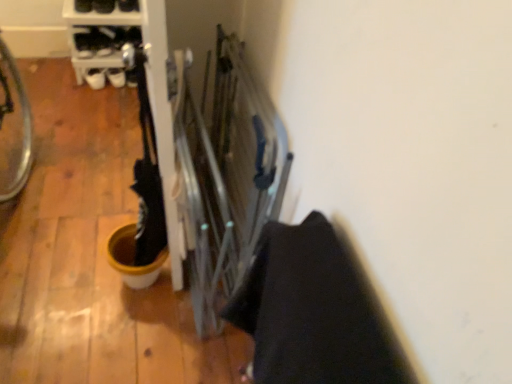
Where is `black leather shoe at upper center, the first footwear when ordered from right to left`? black leather shoe at upper center, the first footwear when ordered from right to left is located at coordinates click(x=128, y=5).

What do you see at coordinates (128, 5) in the screenshot? I see `black leather shoe at upper center, the second footwear when ordered from left to right` at bounding box center [128, 5].

This screenshot has height=384, width=512. What do you see at coordinates (103, 6) in the screenshot?
I see `black leather shoe at upper left, which is the 2th footwear from right to left` at bounding box center [103, 6].

At what (x,y) coordinates should I click in order to perform the action: click on black leather shoe at upper left, which is counted as the 1th footwear, starting from the left. Please return your answer as a coordinate pair (x, y). Looking at the image, I should click on (103, 6).

Identify the location of black leather shoe at upper center, the second footwear when ordered from left to right. (128, 5).

Between black leather shoe at upper left, which is the 2th footwear from right to left, and black leather shoe at upper center, the second footwear when ordered from left to right, which one appears on the right side from the viewer's perspective?

black leather shoe at upper center, the second footwear when ordered from left to right, is more to the right.

Which object is further away from the camera, black leather shoe at upper left, which is counted as the 1th footwear, starting from the left, or black leather shoe at upper center, the first footwear when ordered from right to left?

black leather shoe at upper center, the first footwear when ordered from right to left, is more distant.

Between point (105, 8) and point (137, 7), which one is positioned behind?

The point (105, 8) is farther from the camera.

From the image's perspective, is black leather shoe at upper left, which is counted as the 1th footwear, starting from the left, on black leather shoe at upper center, the second footwear when ordered from left to right?

No, from the image's perspective, black leather shoe at upper left, which is counted as the 1th footwear, starting from the left, is not on top of black leather shoe at upper center, the second footwear when ordered from left to right.

From a real-world perspective, relative to black leather shoe at upper center, the first footwear when ordered from right to left, is black leather shoe at upper left, which is counted as the 1th footwear, starting from the left, vertically above or below?

black leather shoe at upper left, which is counted as the 1th footwear, starting from the left, is above black leather shoe at upper center, the first footwear when ordered from right to left.

Which of these two, black leather shoe at upper left, which is the 2th footwear from right to left, or black leather shoe at upper center, the second footwear when ordered from left to right, is thinner?

black leather shoe at upper center, the second footwear when ordered from left to right, is thinner.

Does black leather shoe at upper left, which is the 2th footwear from right to left, have a greater height compared to black leather shoe at upper center, the first footwear when ordered from right to left?

Indeed, black leather shoe at upper left, which is the 2th footwear from right to left, has a greater height compared to black leather shoe at upper center, the first footwear when ordered from right to left.

Based on their sizes in the image, would you say black leather shoe at upper left, which is counted as the 1th footwear, starting from the left, is bigger or smaller than black leather shoe at upper center, the second footwear when ordered from left to right?

Clearly, black leather shoe at upper left, which is counted as the 1th footwear, starting from the left, is larger in size than black leather shoe at upper center, the second footwear when ordered from left to right.

Is black leather shoe at upper center, the second footwear when ordered from left to right, a part of black leather shoe at upper left, which is the 2th footwear from right to left?

Actually, black leather shoe at upper center, the second footwear when ordered from left to right, is outside black leather shoe at upper left, which is the 2th footwear from right to left.

Is black leather shoe at upper left, which is counted as the 1th footwear, starting from the left, far from black leather shoe at upper center, the first footwear when ordered from right to left?

No, black leather shoe at upper left, which is counted as the 1th footwear, starting from the left, is not far away from black leather shoe at upper center, the first footwear when ordered from right to left.

Does black leather shoe at upper left, which is counted as the 1th footwear, starting from the left, turn towards black leather shoe at upper center, the first footwear when ordered from right to left?

No, black leather shoe at upper left, which is counted as the 1th footwear, starting from the left, does not turn towards black leather shoe at upper center, the first footwear when ordered from right to left.

In the scene shown: How far apart are black leather shoe at upper left, which is the 2th footwear from right to left, and black leather shoe at upper center, the first footwear when ordered from right to left?

black leather shoe at upper left, which is the 2th footwear from right to left, and black leather shoe at upper center, the first footwear when ordered from right to left, are 3.15 inches apart from each other.

I want to click on footwear above the black leather shoe at upper left, which is counted as the 1th footwear, starting from the left (from the image's perspective), so point(128,5).

Considering the relative positions of black leather shoe at upper center, the second footwear when ordered from left to right, and black leather shoe at upper left, which is counted as the 1th footwear, starting from the left, in the image provided, is black leather shoe at upper center, the second footwear when ordered from left to right, to the left of black leather shoe at upper left, which is counted as the 1th footwear, starting from the left, from the viewer's perspective?

In fact, black leather shoe at upper center, the second footwear when ordered from left to right, is to the right of black leather shoe at upper left, which is counted as the 1th footwear, starting from the left.

Consider the image. Between black leather shoe at upper center, the second footwear when ordered from left to right, and black leather shoe at upper left, which is counted as the 1th footwear, starting from the left, which one is positioned in front?

black leather shoe at upper left, which is counted as the 1th footwear, starting from the left.

Does point (126, 1) appear closer or farther from the camera than point (98, 6)?

Point (126, 1) appears to be closer to the viewer than point (98, 6).

From the image's perspective, which object appears higher, black leather shoe at upper center, the second footwear when ordered from left to right, or black leather shoe at upper left, which is counted as the 1th footwear, starting from the left?

black leather shoe at upper center, the second footwear when ordered from left to right.

From a real-world perspective, relative to black leather shoe at upper left, which is counted as the 1th footwear, starting from the left, is black leather shoe at upper center, the first footwear when ordered from right to left, vertically above or below?

black leather shoe at upper center, the first footwear when ordered from right to left, is situated lower than black leather shoe at upper left, which is counted as the 1th footwear, starting from the left, in the real world.

Which of these two, black leather shoe at upper center, the first footwear when ordered from right to left, or black leather shoe at upper left, which is counted as the 1th footwear, starting from the left, is wider?

With larger width is black leather shoe at upper left, which is counted as the 1th footwear, starting from the left.

Who is taller, black leather shoe at upper center, the first footwear when ordered from right to left, or black leather shoe at upper left, which is counted as the 1th footwear, starting from the left?

black leather shoe at upper left, which is counted as the 1th footwear, starting from the left, is taller.

Can you confirm if black leather shoe at upper center, the first footwear when ordered from right to left, is bigger than black leather shoe at upper left, which is counted as the 1th footwear, starting from the left?

Actually, black leather shoe at upper center, the first footwear when ordered from right to left, might be smaller than black leather shoe at upper left, which is counted as the 1th footwear, starting from the left.

Is black leather shoe at upper center, the first footwear when ordered from right to left, inside the boundaries of black leather shoe at upper left, which is the 2th footwear from right to left, or outside?

black leather shoe at upper center, the first footwear when ordered from right to left, is not enclosed by black leather shoe at upper left, which is the 2th footwear from right to left.

Is black leather shoe at upper center, the second footwear when ordered from left to right, positioned far away from black leather shoe at upper left, which is the 2th footwear from right to left?

They are positioned close to each other.

Looking at this image, does black leather shoe at upper center, the first footwear when ordered from right to left, turn towards black leather shoe at upper left, which is counted as the 1th footwear, starting from the left?

No.

How different are the orientations of black leather shoe at upper center, the first footwear when ordered from right to left, and black leather shoe at upper left, which is the 2th footwear from right to left, in degrees?

There is a 1.59-degree angle between the facing directions of black leather shoe at upper center, the first footwear when ordered from right to left, and black leather shoe at upper left, which is the 2th footwear from right to left.

Identify the location of footwear that is on the left side of black leather shoe at upper center, the first footwear when ordered from right to left. The height and width of the screenshot is (384, 512). (103, 6).

The height and width of the screenshot is (384, 512). What are the coordinates of `footwear that appears behind the black leather shoe at upper left, which is the 2th footwear from right to left` in the screenshot? It's located at (128, 5).

You are a GUI agent. You are given a task and a screenshot of the screen. Output one action in this format:
    pyautogui.click(x=<x>, y=<y>)
    Task: Click on the footwear in front of the black leather shoe at upper center, the second footwear when ordered from left to right
    The image size is (512, 384).
    Given the screenshot: What is the action you would take?
    point(103,6)